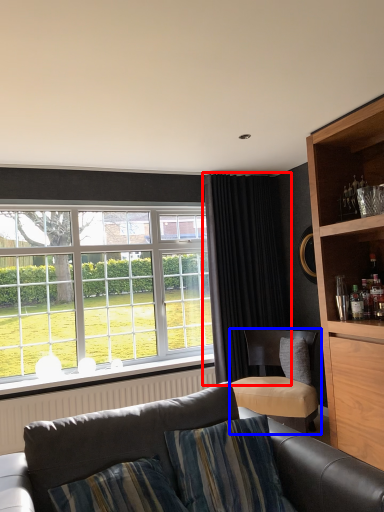
Question: Which point is further to the camera, curtain (highlighted by a red box) or chair (highlighted by a blue box)?

Choices:
 (A) curtain
 (B) chair

Answer: (A)